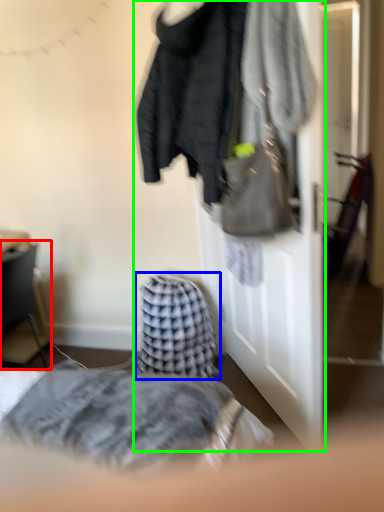
Question: Which object is the farthest from furniture (highlighted by a red box)? Choose among these: blanket (highlighted by a blue box) or closet (highlighted by a green box).

Choices:
 (A) blanket
 (B) closet

Answer: (B)